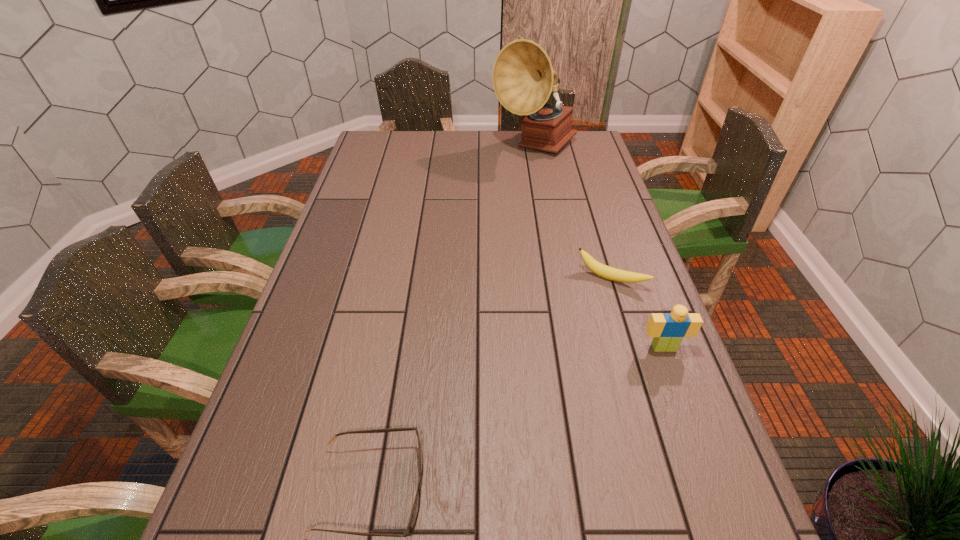
I want to click on vacant area at the right edge, so click(x=594, y=247).

In order to click on vacant space at the far left corner of the desktop in this screenshot , I will do `click(405, 143)`.

Image resolution: width=960 pixels, height=540 pixels. I want to click on blank area at the far right corner, so click(577, 150).

At what (x,y) coordinates should I click in order to perform the action: click on empty space between the farthest object and the Lego. Please return your answer as a coordinate pair (x, y). Image resolution: width=960 pixels, height=540 pixels. Looking at the image, I should click on (599, 248).

Find the location of `vacant area that lies between the Lego and the banana`. vacant area that lies between the Lego and the banana is located at coordinates (637, 313).

You are a GUI agent. You are given a task and a screenshot of the screen. Output one action in this format:
    pyautogui.click(x=<x>, y=<y>)
    Task: Click on the free space that is in between the second nearest object and the banana
    The width and height of the screenshot is (960, 540).
    Given the screenshot: What is the action you would take?
    pyautogui.click(x=637, y=313)

You are a GUI agent. You are given a task and a screenshot of the screen. Output one action in this format:
    pyautogui.click(x=<x>, y=<y>)
    Task: Click on the vacant space that is in between the Lego and the farthest object
    The height and width of the screenshot is (540, 960).
    Given the screenshot: What is the action you would take?
    pyautogui.click(x=599, y=248)

The width and height of the screenshot is (960, 540). In order to click on free point between the Lego and the third nearest object in this screenshot , I will do `click(637, 313)`.

Locate an element on the screen. The width and height of the screenshot is (960, 540). the closest object relative to the tallest object is located at coordinates (607, 272).

Locate an element on the screen. This screenshot has width=960, height=540. object that is the third closest to the shortest object is located at coordinates (523, 78).